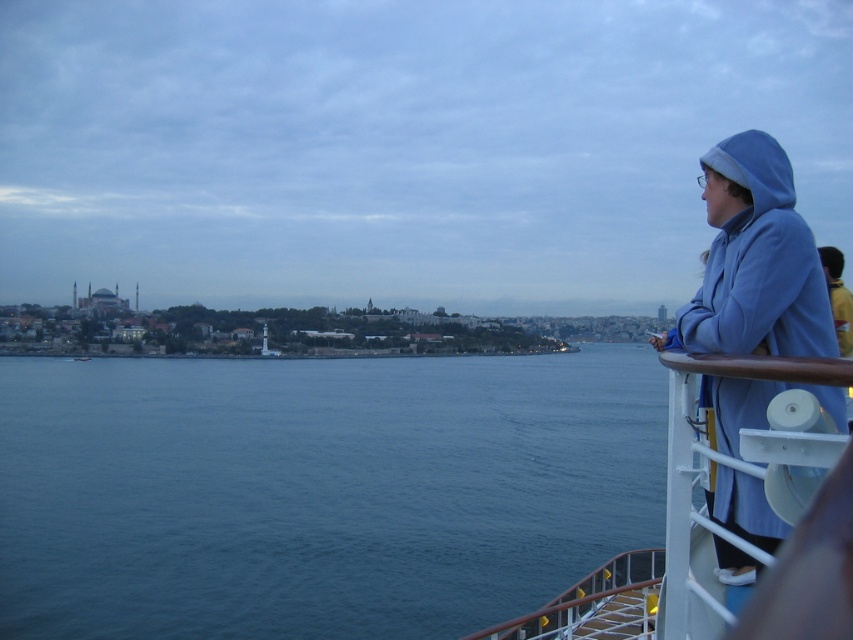
From the picture: You are standing on the cruise ship deck and want to take a photo of the blue water at lower left without the white plastic railing at right appearing in the frame. How should you position yourself?

Move to the left side of the deck so that the blue water at lower left is visible and positioned below the white plastic railing at right, ensuring the railing does not block the view.

You are standing on the deck of a cruise ship and want to take a photo of the blue water at lower left. According to the scene description, where should you aim your camera?

You should aim your camera at point (318, 490) to capture the blue water at lower left as described.